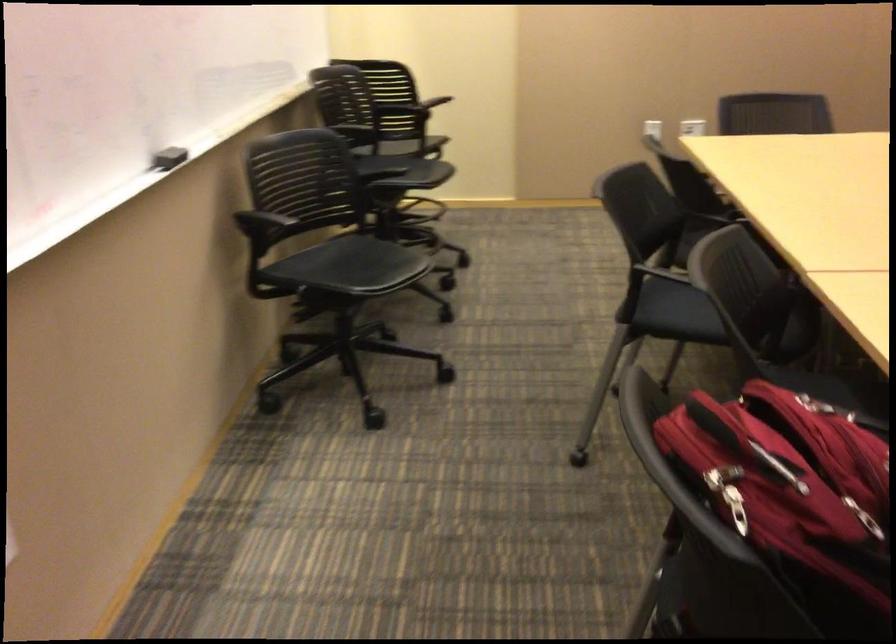
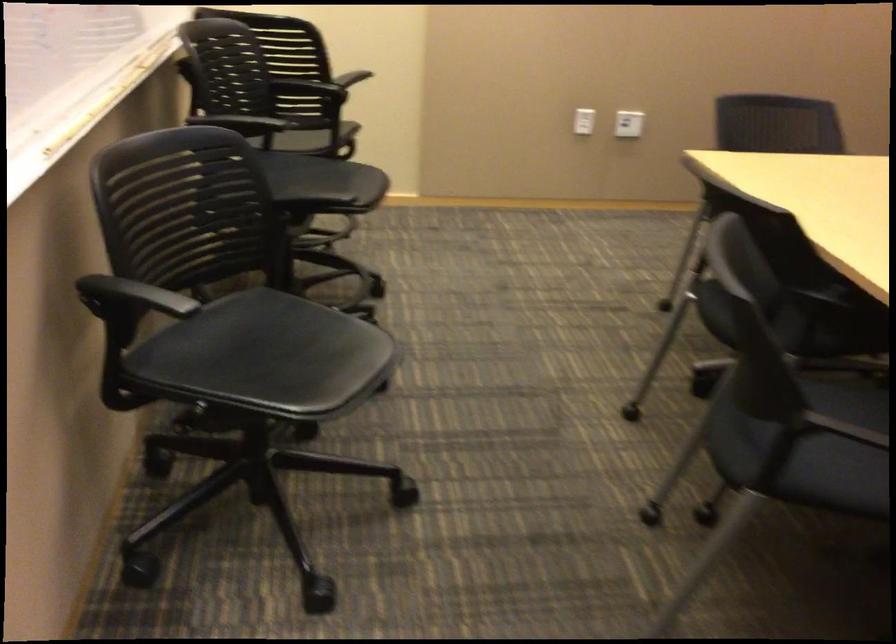
In the second image, find the point that corresponds to [691,310] in the first image.

(804, 442)